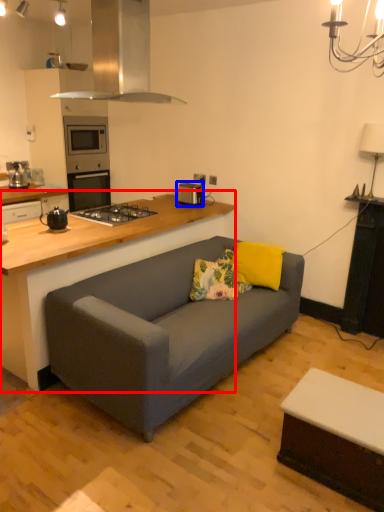
Question: Among these objects, which one is farthest to the camera, countertop (highlighted by a red box) or appliance (highlighted by a blue box)?

Choices:
 (A) countertop
 (B) appliance

Answer: (B)